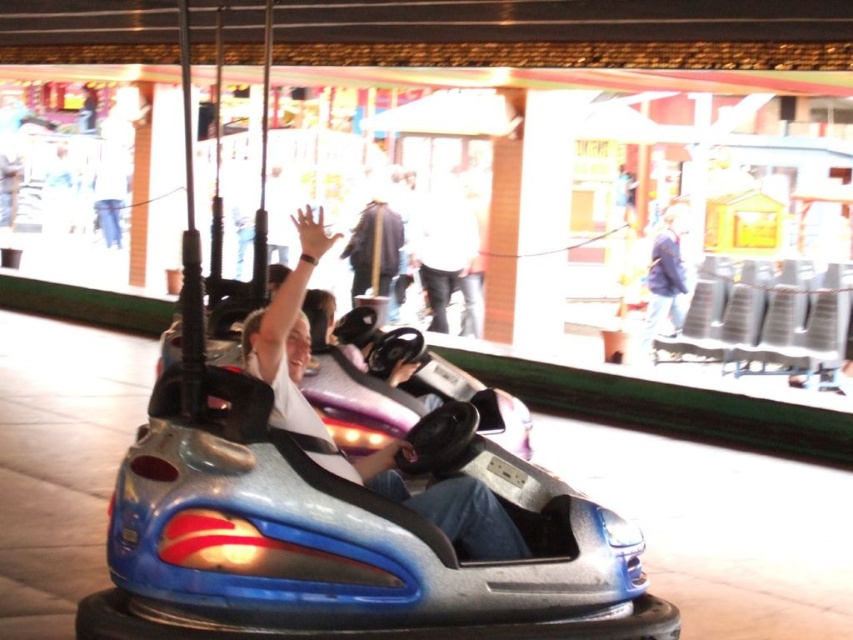
Question: Can you confirm if matte white shirt at center is positioned to the left of blue fabric jacket at upper right?

Choices:
 (A) no
 (B) yes

Answer: (B)

Question: Which point is farther to the camera?

Choices:
 (A) matte white shirt at center
 (B) blue fabric jacket at upper right

Answer: (B)

Question: Which object is closer to the camera taking this photo?

Choices:
 (A) blue fabric jacket at upper right
 (B) matte white shirt at center

Answer: (B)

Question: Is matte white shirt at center closer to camera compared to blue fabric jacket at upper right?

Choices:
 (A) no
 (B) yes

Answer: (B)

Question: Which point is farther from the camera taking this photo?

Choices:
 (A) (677, 280)
 (B) (326, 456)

Answer: (A)

Question: Is matte white shirt at center bigger than blue fabric jacket at upper right?

Choices:
 (A) no
 (B) yes

Answer: (A)